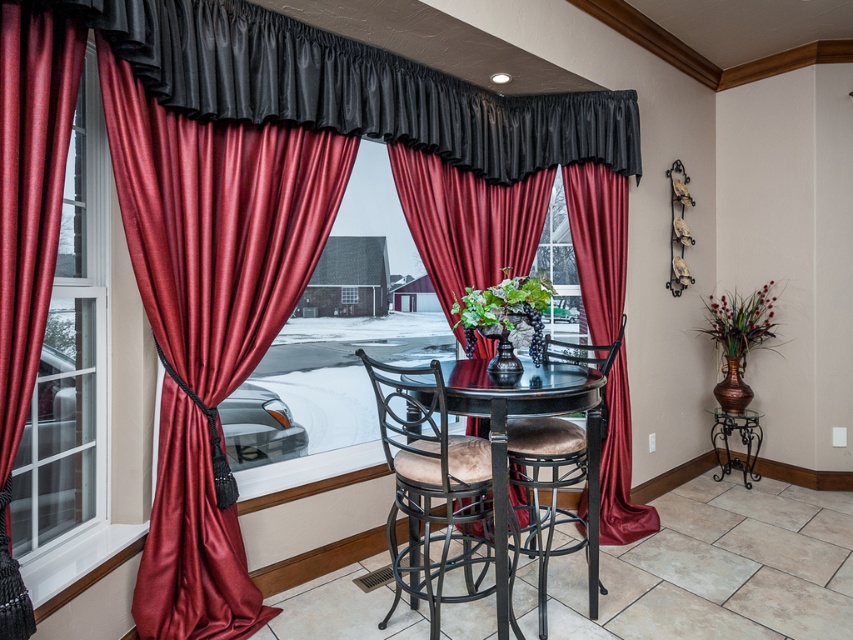
You are planning to hang a large painting that requires a tall space. Based on the scene, which object between the satin red curtain at center and the velvet tan chair at center would you choose to place the painting above?

The satin red curtain at center is much taller than the velvet tan chair at center, so placing the painting above the satin red curtain at center would provide the necessary tall space required.

You are planning to hang a large painting on the wall between the satin red curtains at left and the velvet tan chair at center. Which object should the painting be placed closer to if you want it to be taller than both objects?

The painting should be placed closer to the satin red curtains at left since it is much taller than the velvet tan chair at center, allowing the painting to surpass both in height.

You are planning to move the velvet tan chair at center closer to the satin red curtain at center. Based on their sizes, do you think there is enough space between them to move the chair without needing to adjust the curtain?

The satin red curtain at center is bigger than the velvet tan chair at center, so there should be enough space to move the chair closer without adjusting the curtain.